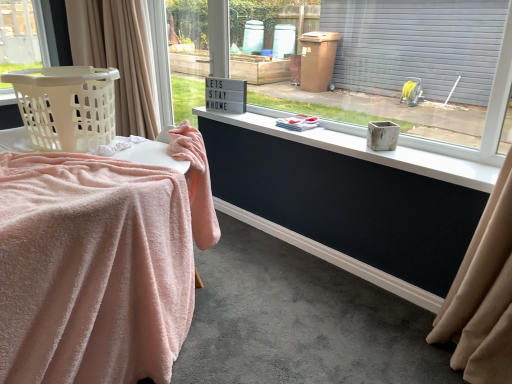
Question: Is point (380, 152) closer or farther from the camera than point (134, 79)?

Choices:
 (A) farther
 (B) closer

Answer: (B)

Question: From the image's perspective, is white matte concrete at center above or below beige fabric curtain at left?

Choices:
 (A) below
 (B) above

Answer: (A)

Question: Which of these objects is positioned farthest from the beige fabric curtain at left?

Choices:
 (A) white matte concrete at center
 (B) beige plastic laundry basket at left
 (C) white plastic sign at upper center
 (D) pink fluffy blanket at left
 (E) matte concrete planter at center

Answer: (E)

Question: Which object is positioned closest to the white matte concrete at center?

Choices:
 (A) white plastic sign at upper center
 (B) pink fluffy blanket at left
 (C) beige plastic laundry basket at left
 (D) beige fabric curtain at left
 (E) matte concrete planter at center

Answer: (E)